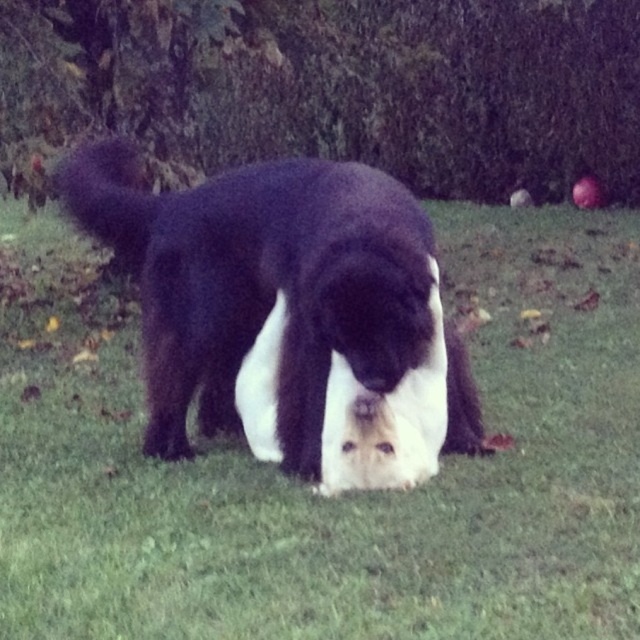
Question: Among these objects, which one is farthest from the camera?

Choices:
 (A) black fur dog at center
 (B) green grass at center

Answer: (B)

Question: Can you confirm if green grass at center is positioned below black fur dog at center?

Choices:
 (A) yes
 (B) no

Answer: (A)

Question: Is green grass at center below black fur dog at center?

Choices:
 (A) no
 (B) yes

Answer: (B)

Question: Among these objects, which one is farthest from the camera?

Choices:
 (A) black fur dog at center
 (B) green grass at center

Answer: (B)

Question: Which point is farther to the camera?

Choices:
 (A) black fur dog at center
 (B) green grass at center

Answer: (B)

Question: Is green grass at center wider than black fur dog at center?

Choices:
 (A) no
 (B) yes

Answer: (A)